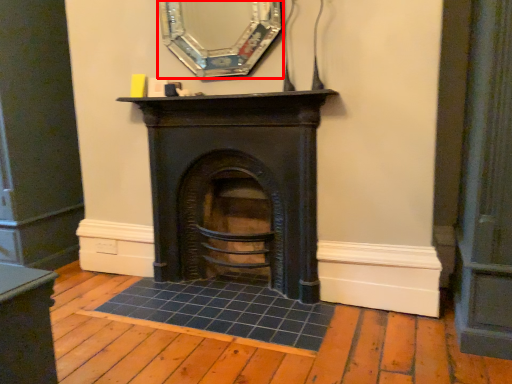
Question: In this image, where is mirror (annotated by the red box) located relative to fireplace?

Choices:
 (A) right
 (B) left

Answer: (B)